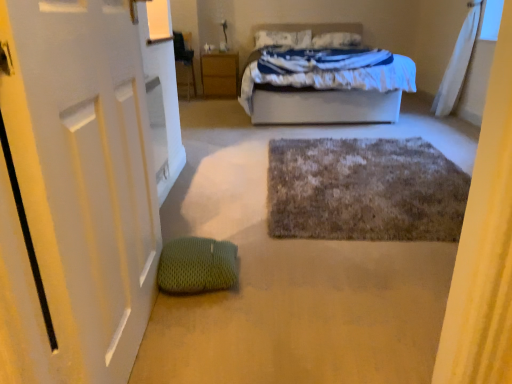
Question: Is white soft bed at center surrounding white soft pillow at upper center, which is counted as the first pillow, starting from the left?

Choices:
 (A) no
 (B) yes

Answer: (B)

Question: From a real-world perspective, is white soft bed at center on top of white soft pillow at upper center, which ranks as the second pillow in right-to-left order?

Choices:
 (A) no
 (B) yes

Answer: (A)

Question: Is white soft bed at center oriented away from white soft pillow at upper center, which is counted as the first pillow, starting from the left?

Choices:
 (A) no
 (B) yes

Answer: (B)

Question: Can we say white soft bed at center lies outside white soft pillow at upper center, which ranks as the second pillow in right-to-left order?

Choices:
 (A) yes
 (B) no

Answer: (A)

Question: From the image's perspective, is white soft bed at center under white soft pillow at upper center, which is counted as the first pillow, starting from the left?

Choices:
 (A) yes
 (B) no

Answer: (A)

Question: From a real-world perspective, relative to wooden nightstand at center, is fuzzy gray bath mat at center vertically above or below?

Choices:
 (A) below
 (B) above

Answer: (A)

Question: From the image's perspective, relative to wooden nightstand at center, is fuzzy gray bath mat at center above or below?

Choices:
 (A) below
 (B) above

Answer: (A)

Question: Considering the positions of fuzzy gray bath mat at center and wooden nightstand at center in the image, is fuzzy gray bath mat at center wider or thinner than wooden nightstand at center?

Choices:
 (A) wide
 (B) thin

Answer: (A)

Question: Looking at the image, does fuzzy gray bath mat at center seem bigger or smaller compared to wooden nightstand at center?

Choices:
 (A) small
 (B) big

Answer: (A)

Question: In the image, is wooden nightstand at center on the left side or the right side of white soft pillow at upper center, the second pillow in the left-to-right sequence?

Choices:
 (A) right
 (B) left

Answer: (B)

Question: In the image, is wooden nightstand at center positioned in front of or behind white soft pillow at upper center, the 1th pillow from the right?

Choices:
 (A) front
 (B) behind

Answer: (A)

Question: From the image's perspective, is wooden nightstand at center above or below white soft pillow at upper center, the second pillow in the left-to-right sequence?

Choices:
 (A) above
 (B) below

Answer: (B)

Question: From a real-world perspective, is wooden nightstand at center physically located above or below white soft pillow at upper center, the second pillow in the left-to-right sequence?

Choices:
 (A) above
 (B) below

Answer: (B)

Question: Is white soft bed at center bigger or smaller than white matte door at left?

Choices:
 (A) small
 (B) big

Answer: (B)

Question: In terms of height, does white soft bed at center look taller or shorter compared to white matte door at left?

Choices:
 (A) short
 (B) tall

Answer: (A)